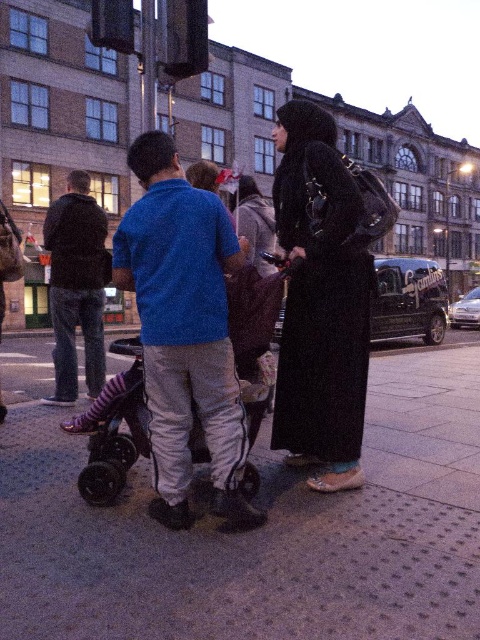
You are a delivery person trying to navigate a narrow sidewalk. You see the gray concrete pavement at center and the black rubber baby carriage at center. Which object is located to the right of the other?

The gray concrete pavement at center is to the right of the black rubber baby carriage at center, so the gray concrete pavement is positioned to the right side of the black rubber baby carriage.

You are a delivery person trying to place a small package on the gray concrete pavement at center and the black matte coat at center. Which surface can you place the package on without it falling off?

The black matte coat at center is wider than the gray concrete pavement at center, so placing the package on the black matte coat at center would be more stable and less likely to fall off.